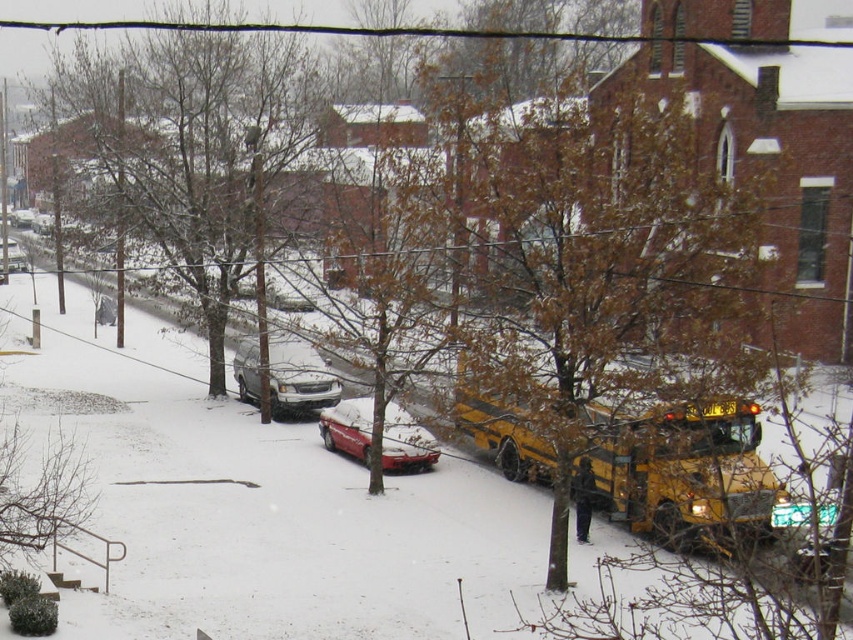
Who is higher up, silver metallic suv at center or shiny red car at center?

silver metallic suv at center

Between silver metallic suv at center and shiny red car at center, which one is positioned lower?

shiny red car at center is below.

Describe the element at coordinates (299, 378) in the screenshot. The image size is (853, 640). I see `silver metallic suv at center` at that location.

I want to click on silver metallic suv at center, so click(x=299, y=378).

Can you confirm if yellow matte school bus at center is positioned above silver metallic suv at center?

No, yellow matte school bus at center is not above silver metallic suv at center.

Between yellow matte school bus at center and silver metallic suv at center, which one appears on the right side from the viewer's perspective?

yellow matte school bus at center

Is point (691, 436) more distant than point (236, 378)?

That is False.

Find the location of a particular element. The image size is (853, 640). yellow matte school bus at center is located at coordinates (680, 467).

Is yellow matte school bus at center below shiny red car at center?

Incorrect, yellow matte school bus at center is not positioned below shiny red car at center.

Is yellow matte school bus at center above shiny red car at center?

Correct, yellow matte school bus at center is located above shiny red car at center.

Who is more distant from viewer, (726, 472) or (409, 438)?

Point (409, 438)

Identify the location of yellow matte school bus at center. point(680,467).